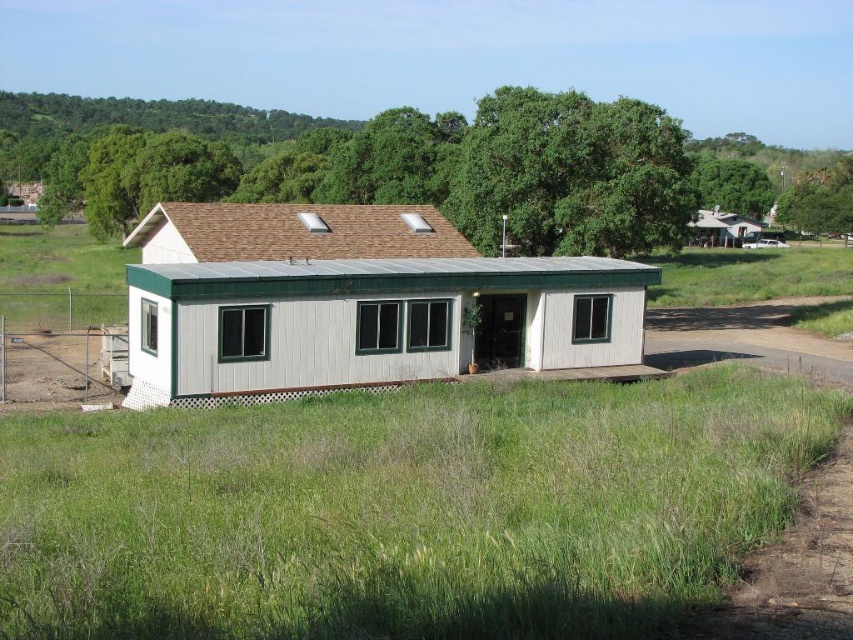
Is point (172, 417) closer to camera compared to point (173, 244)?

Yes, it is.

What do you see at coordinates (404, 509) in the screenshot? The height and width of the screenshot is (640, 853). I see `green grass at lower center` at bounding box center [404, 509].

Locate an element on the screen. green grass at lower center is located at coordinates (404, 509).